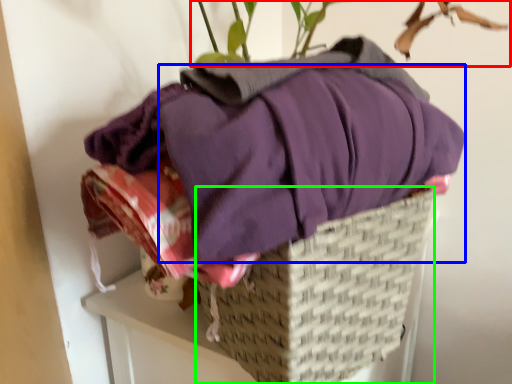
Question: Which object is the closest to the houseplant (highlighted by a red box)? Choose among these: clothing (highlighted by a blue box) or basket (highlighted by a green box).

Choices:
 (A) clothing
 (B) basket

Answer: (A)